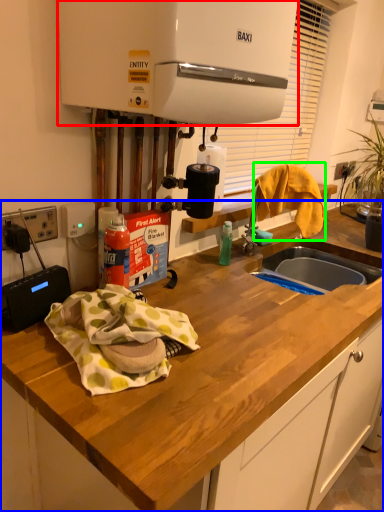
Question: Considering the real-world distances, which object is closest to home appliance (highlighted by a red box)? countertop (highlighted by a blue box) or clothe (highlighted by a green box).

Choices:
 (A) countertop
 (B) clothe

Answer: (B)